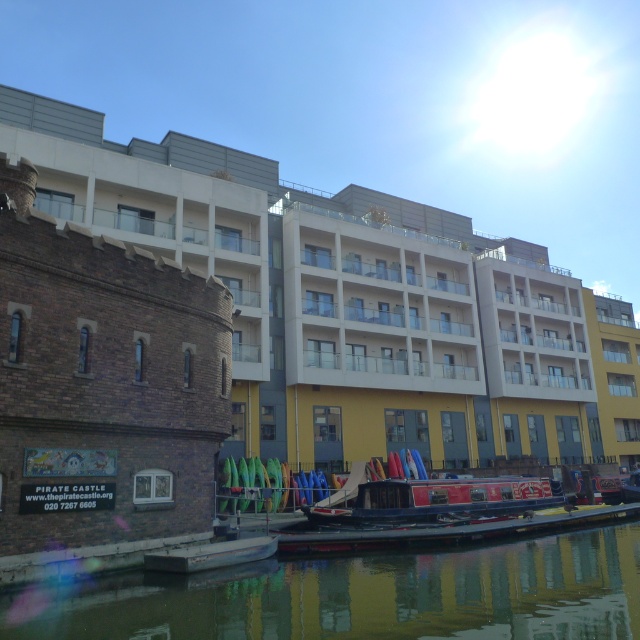
Question: Can you confirm if smooth reflective water at center is bigger than blue polished wood barge at center?

Choices:
 (A) no
 (B) yes

Answer: (B)

Question: Which point is farther from the camera taking this photo?

Choices:
 (A) (545, 499)
 (B) (417, 557)

Answer: (A)

Question: Is smooth reflective water at center closer to camera compared to blue polished wood barge at center?

Choices:
 (A) no
 (B) yes

Answer: (B)

Question: Among these objects, which one is nearest to the camera?

Choices:
 (A) smooth reflective water at center
 (B) blue polished wood barge at center

Answer: (A)

Question: From the image, what is the correct spatial relationship of smooth reflective water at center in relation to blue polished wood barge at center?

Choices:
 (A) above
 (B) below

Answer: (A)